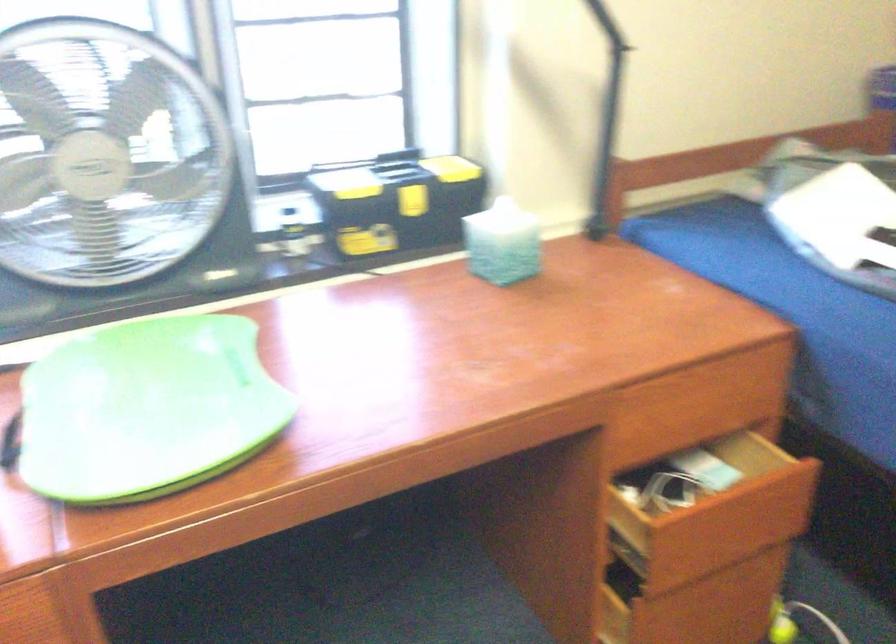
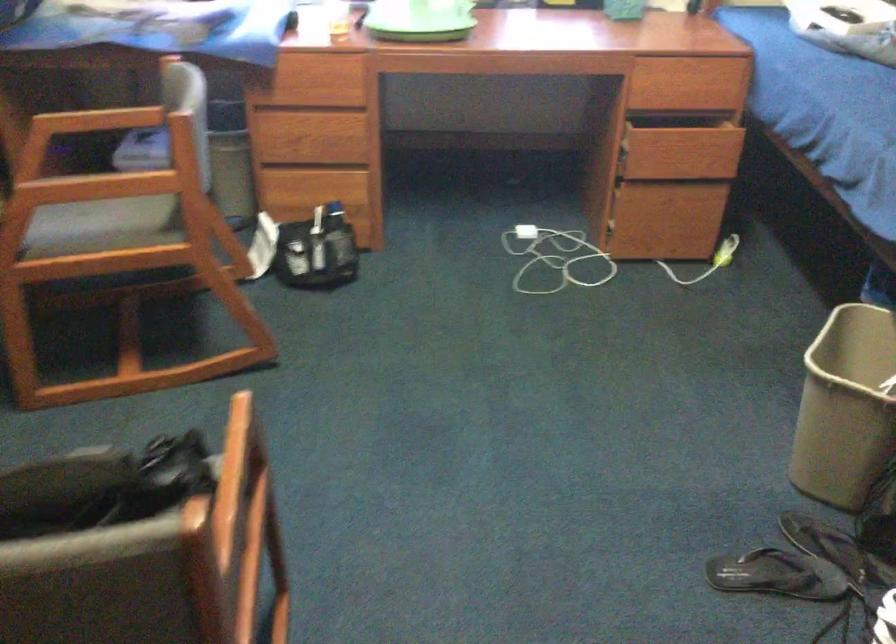
The images are taken continuously from a first-person perspective. In which direction are you moving?

The movement direction of the cameraman is right, backward.